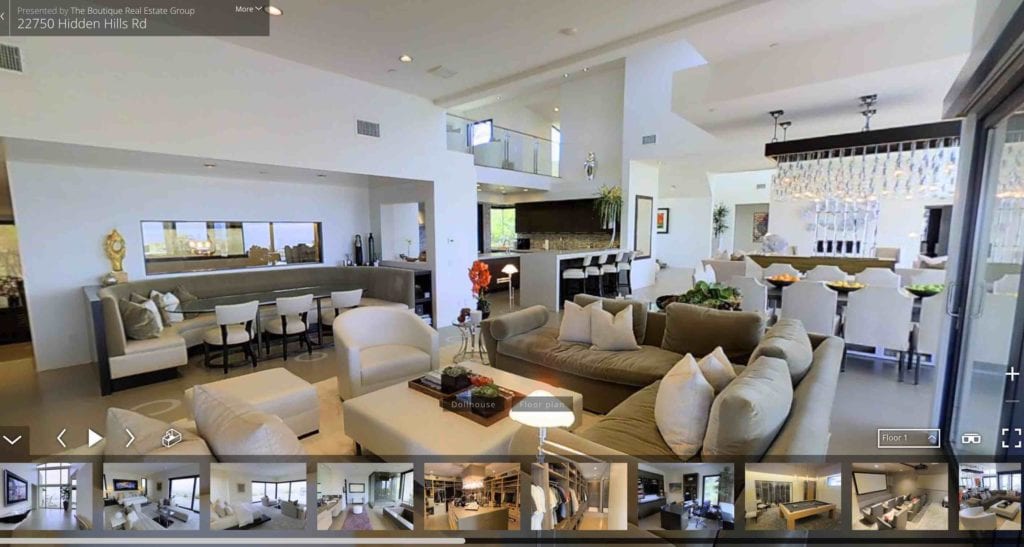
This screenshot has width=1024, height=547. What are the coordinates of `theater room` in the screenshot? It's located at (908, 500).